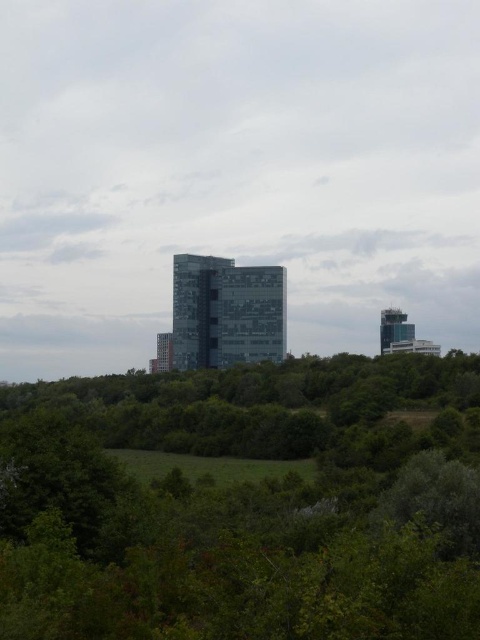
You are an architect analyzing the urban landscape. You observe the glassy reflective tower at right and the transparent glass tower at center. Based on their positions in the scene, which tower appears taller when viewed from your current vantage point?

The glassy reflective tower at right appears taller because it is positioned above the transparent glass tower at center in the scene.

You are standing in the park and see the green leafy tree at center and the glassy reflective building at center. Which one is closer to you?

The green leafy tree at center is closer to you because it is positioned in front of the glassy reflective building at center.

You are standing in the park area with dense greenery and want to take a photo of the glassy reflective tower at right. If your camera has a maximum zoom range of 200 meters, will you be able to capture the tower clearly without moving closer?

The glassy reflective tower at right is 345.91 meters away from the viewer. Since your camera can only zoom up to 200 meters, you won letf capture the tower clearly without moving closer.